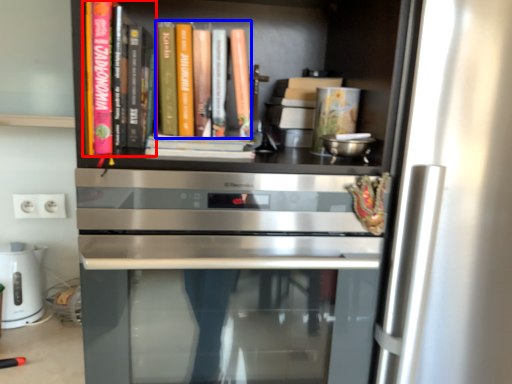
Question: Among these objects, which one is farthest to the camera, book (highlighted by a red box) or book (highlighted by a blue box)?

Choices:
 (A) book
 (B) book

Answer: (B)